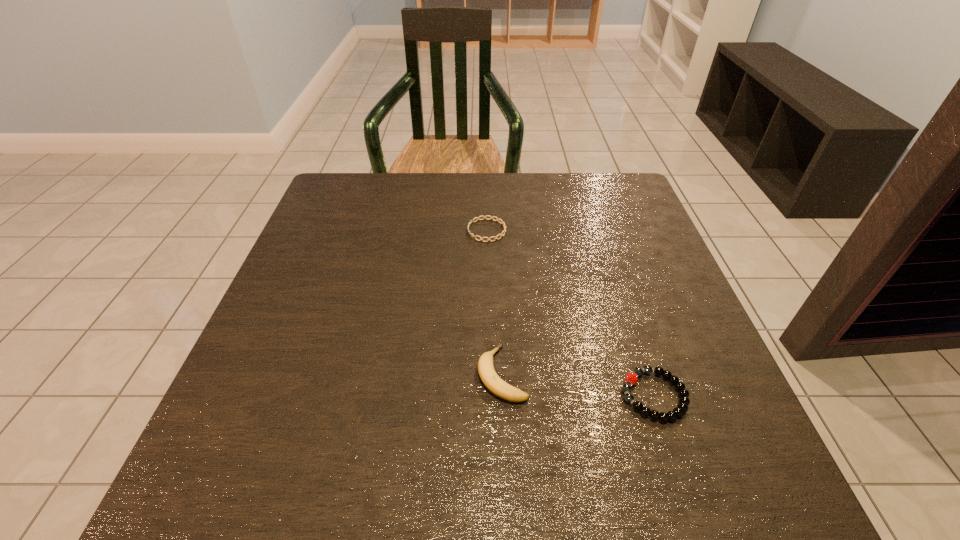
Where is `free spot that satisfies the following two spatial constraints: 1. on the surface of the farther bracelet showing star-shaped elements; 2. on the left side of the second shortest object`? This screenshot has width=960, height=540. free spot that satisfies the following two spatial constraints: 1. on the surface of the farther bracelet showing star-shaped elements; 2. on the left side of the second shortest object is located at coordinates (491, 395).

The image size is (960, 540). I want to click on free space that satisfies the following two spatial constraints: 1. on the surface of the tallest object showing star-shaped elements; 2. on the left side of the shorter bracelet, so click(x=490, y=374).

Locate an element on the screen. The image size is (960, 540). vacant space that satisfies the following two spatial constraints: 1. on the front side of the banana; 2. on the left side of the taller bracelet is located at coordinates (503, 395).

Find the location of a particular element. The width and height of the screenshot is (960, 540). vacant space that satisfies the following two spatial constraints: 1. on the surface of the banana showing star-shaped elements; 2. on the right side of the shorter bracelet is located at coordinates (490, 374).

Identify the location of vacant space that satisfies the following two spatial constraints: 1. on the surface of the shorter bracelet showing star-shaped elements; 2. on the back side of the banana. The image size is (960, 540). (490, 374).

Identify the location of vacant area in the image that satisfies the following two spatial constraints: 1. on the front side of the taller bracelet; 2. on the left side of the tallest object. This screenshot has height=540, width=960. (503, 395).

Locate an element on the screen. The image size is (960, 540). vacant position in the image that satisfies the following two spatial constraints: 1. on the surface of the tallest object showing star-shaped elements; 2. on the right side of the shortest object is located at coordinates (490, 374).

Identify the location of vacant region that satisfies the following two spatial constraints: 1. on the surface of the rightmost object showing star-shaped elements; 2. on the left side of the left bracelet. The image size is (960, 540). (491, 395).

The height and width of the screenshot is (540, 960). I want to click on free space in the image that satisfies the following two spatial constraints: 1. on the surface of the shortest object showing star-shaped elements; 2. on the back side of the second tallest object, so click(x=491, y=395).

Image resolution: width=960 pixels, height=540 pixels. I want to click on vacant region that satisfies the following two spatial constraints: 1. on the surface of the tallest object showing star-shaped elements; 2. on the left side of the farther bracelet, so click(x=490, y=374).